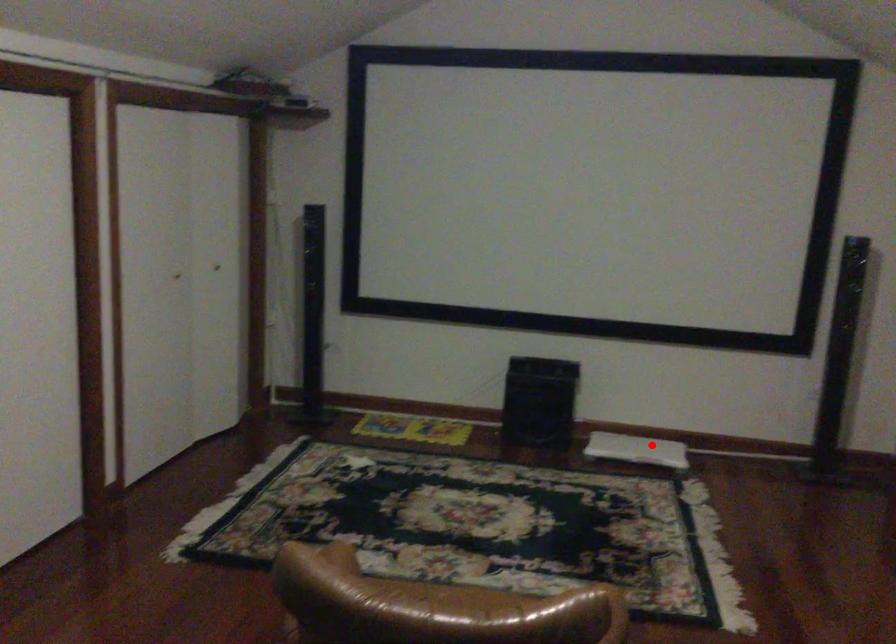
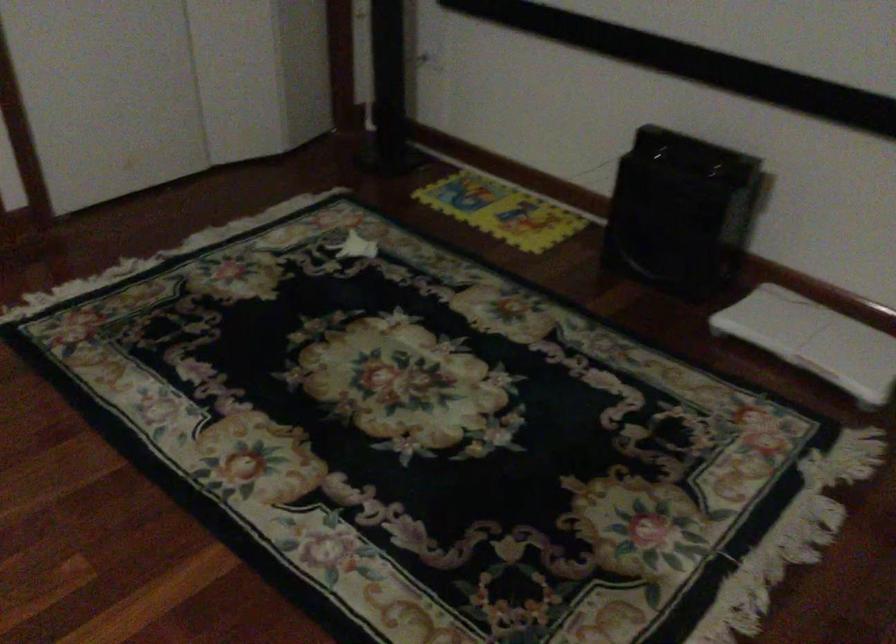
In the second image, find the point that corresponds to the highlighted location in the first image.

(814, 339)